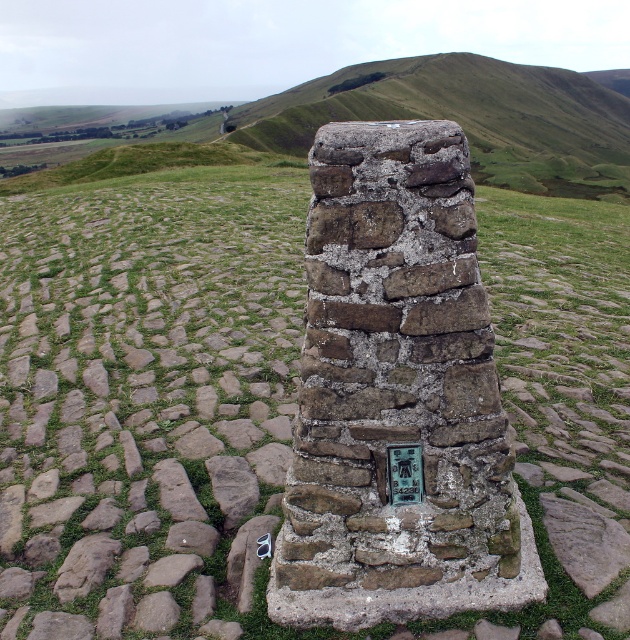
You are standing at the starting point of the cobblestone path. You want to place a new marker exactly 0.3 meters to the north of the weathered stone marker at center. What coordinate should you use for the new marker?

The new marker should be placed at coordinate point (396, 396) minus 0.3 meters north. Since the original marker is at (396, 396), subtracting 0.3 meters north would adjust the y coordinate. However, without knowing the coordinate system scale, we can only state the relative position as north of the weathered stone marker at center by 0.3 meters.

You are a hiker who just found a metallic gray sunglasses at center near a weathered stone marker at center. You want to place your sunglasses on the stone marker so they won

The weathered stone marker at center and metallic gray sunglasses at center are 34.94 inches apart. Since the distance is greater than the typical reach of a person, you cannot place the sunglasses on the marker without moving closer.

You are standing on the cobblestone path and want to read the text on the plaque of the weathered stone marker at center. If your arm can reach up to 1.8 meters, can you touch the plaque?

The weathered stone marker at center is 1.91 meters away from the camera. Since your arm can reach up to 1.8 meters, you cannot touch the plaque.